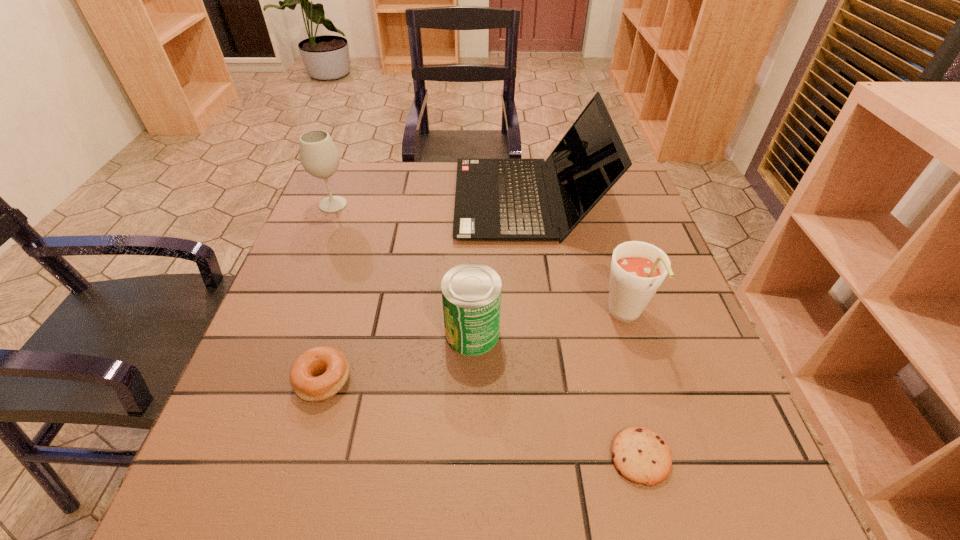
Image resolution: width=960 pixels, height=540 pixels. I want to click on empty space that is in between the second object from left to right and the cookie, so click(482, 418).

This screenshot has width=960, height=540. I want to click on vacant space that's between the wineglass and the root beer, so click(479, 261).

The width and height of the screenshot is (960, 540). Find the location of `the second closest object relative to the cookie`. the second closest object relative to the cookie is located at coordinates (471, 292).

Choose which object is the nearest neighbor to the bagel. Please provide its 2D coordinates. Your answer should be formatted as a tuple, i.e. [(x, y)], where the tuple contains the x and y coordinates of a point satisfying the conditions above.

[(471, 292)]

The image size is (960, 540). What are the coordinates of `free space that satisfies the following two spatial constraints: 1. on the screen of the laptop computer; 2. on the right side of the nearest object` in the screenshot? It's located at (559, 457).

This screenshot has width=960, height=540. Identify the location of vacant region that satisfies the following two spatial constraints: 1. on the screen of the laptop computer; 2. on the front side of the leftmost object. (527, 205).

Locate an element on the screen. vacant space that satisfies the following two spatial constraints: 1. on the back side of the can; 2. on the right side of the bagel is located at coordinates click(337, 333).

Find the location of a particular element. The width and height of the screenshot is (960, 540). free space that satisfies the following two spatial constraints: 1. on the front side of the wineglass; 2. on the right side of the shortest object is located at coordinates (232, 457).

Locate an element on the screen. This screenshot has height=540, width=960. free space that satisfies the following two spatial constraints: 1. on the screen of the laptop computer; 2. on the right side of the shortest object is located at coordinates (559, 457).